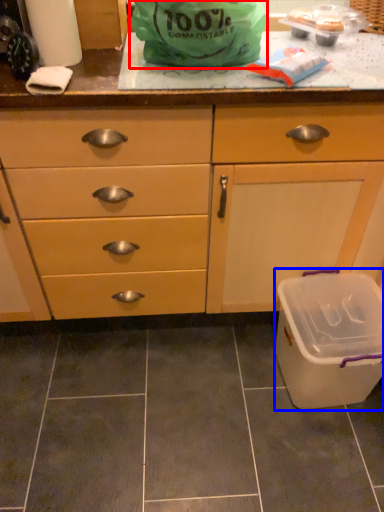
Question: Which point is further to the camera, plastic bag (highlighted by a red box) or recycling bin (highlighted by a blue box)?

Choices:
 (A) plastic bag
 (B) recycling bin

Answer: (B)